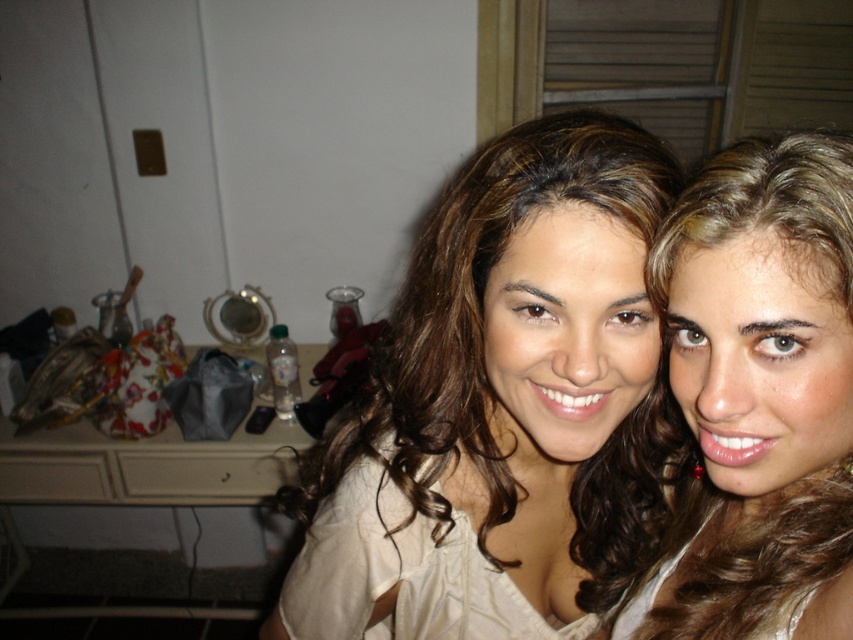
Question: Observing the image, what is the correct spatial positioning of matte beige blouse at center in reference to blonde hair at center?

Choices:
 (A) left
 (B) right

Answer: (A)

Question: Is matte beige blouse at center bigger than blonde hair at center?

Choices:
 (A) yes
 (B) no

Answer: (A)

Question: Is matte beige blouse at center bigger than blonde hair at center?

Choices:
 (A) yes
 (B) no

Answer: (A)